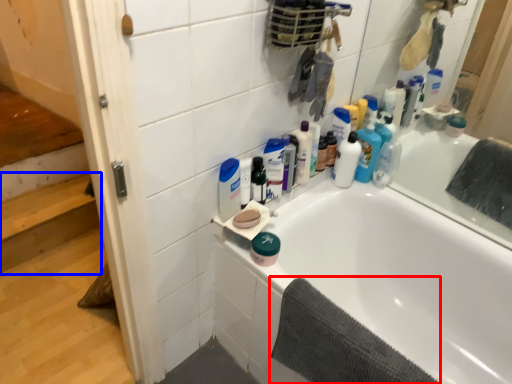
Question: Which object appears farthest to the camera in this image, bath towel (highlighted by a red box) or stairwell (highlighted by a blue box)?

Choices:
 (A) bath towel
 (B) stairwell

Answer: (B)